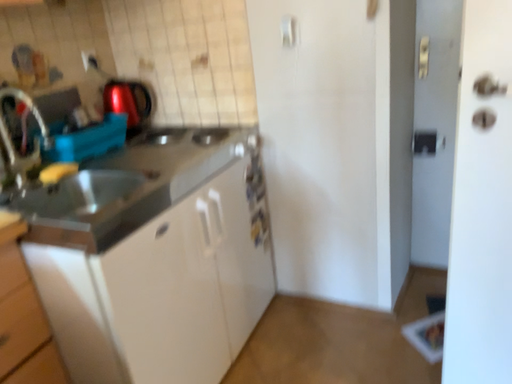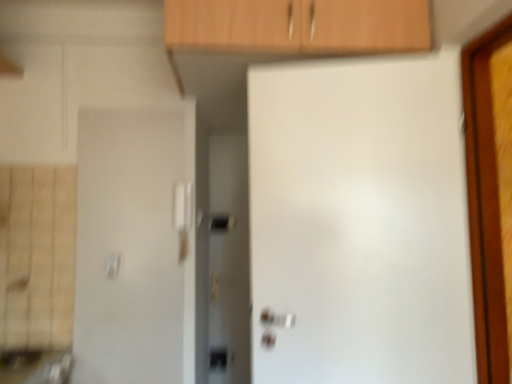
Question: Which way did the camera rotate in the video?

Choices:
 (A) rotated left
 (B) rotated right

Answer: (B)